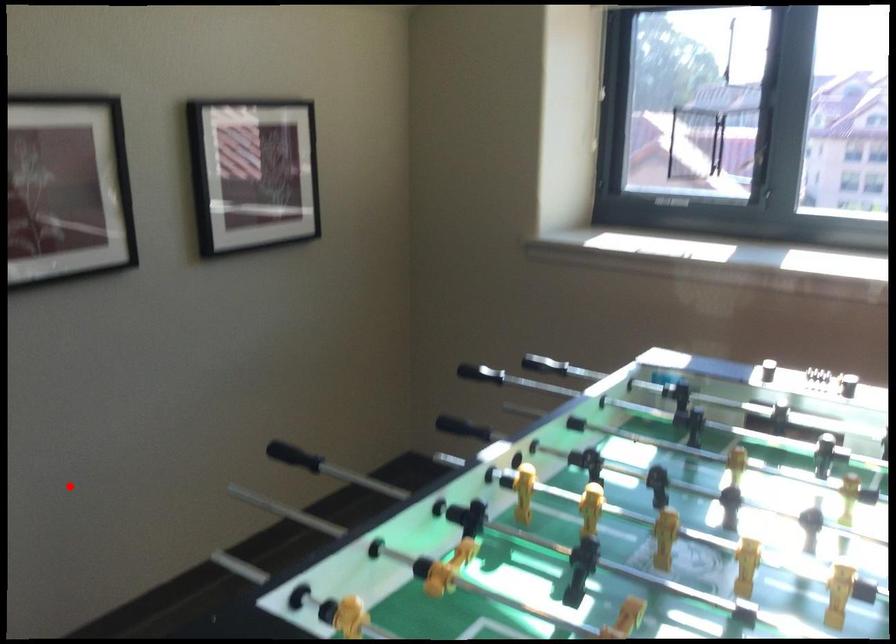
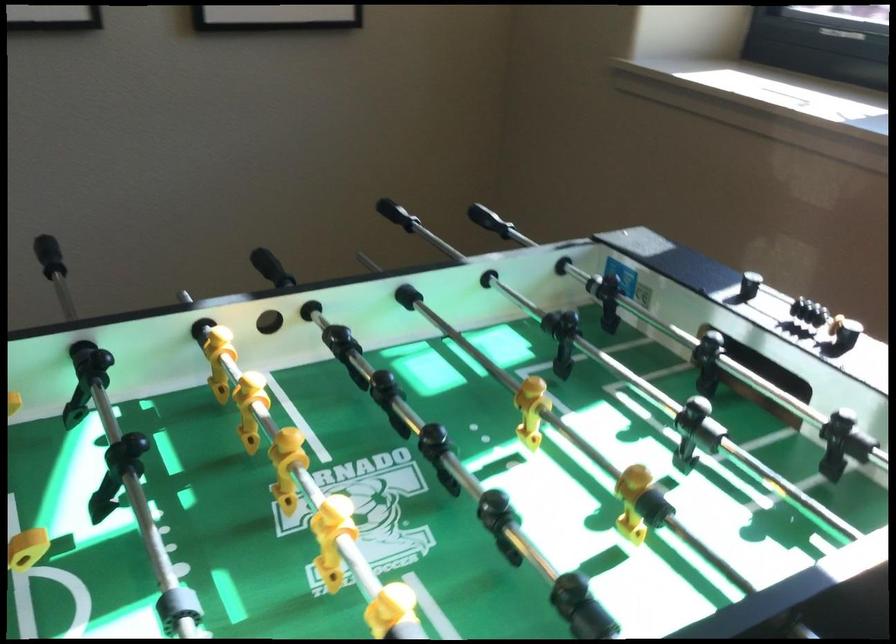
Locate, in the second image, the point that corresponds to the highlighted location in the first image.

(48, 256)